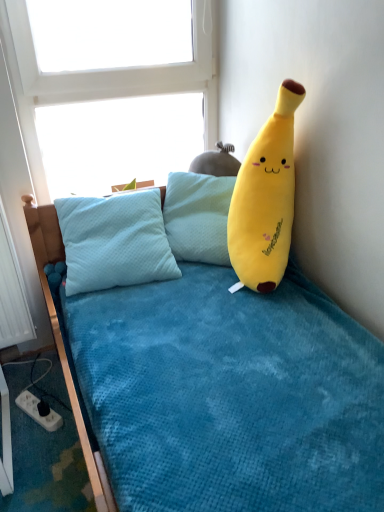
I want to click on soft yellow plush banana at upper right, so click(265, 199).

What do you see at coordinates (265, 199) in the screenshot? The image size is (384, 512). I see `soft yellow plush banana at upper right` at bounding box center [265, 199].

This screenshot has width=384, height=512. I want to click on transparent glass window at upper center, so click(x=105, y=79).

Does point (56, 417) come behind point (233, 219)?

That is True.

In the scene shown: Considering the sizes of objects white plastic power outlet at lower left and soft yellow plush banana at upper right in the image provided, who is taller, white plastic power outlet at lower left or soft yellow plush banana at upper right?

Standing taller between the two is soft yellow plush banana at upper right.

From a real-world perspective, which is physically above, white plastic power outlet at lower left or soft yellow plush banana at upper right?

soft yellow plush banana at upper right, from a real-world perspective.

From the image's perspective, is white plastic power outlet at lower left located above or below soft yellow plush banana at upper right?

white plastic power outlet at lower left is below soft yellow plush banana at upper right.

Where is `toy lying in front of the white plastic power outlet at lower left`? The width and height of the screenshot is (384, 512). toy lying in front of the white plastic power outlet at lower left is located at coordinates (265, 199).

Are soft yellow plush banana at upper right and white plastic power outlet at lower left making contact?

No, soft yellow plush banana at upper right is not touching white plastic power outlet at lower left.

Could you tell me if soft yellow plush banana at upper right is turned towards white plastic power outlet at lower left?

No, soft yellow plush banana at upper right is not facing towards white plastic power outlet at lower left.

Who is taller, soft yellow plush banana at upper right or white plastic power outlet at lower left?

soft yellow plush banana at upper right.

What are the coordinates of `toy lying on the right of transparent glass window at upper center` in the screenshot? It's located at (265, 199).

Is point (1, 28) closer or farther from the camera than point (282, 93)?

Point (1, 28) is farther from the camera than point (282, 93).

Is transparent glass window at upper center not within soft yellow plush banana at upper right?

transparent glass window at upper center is positioned outside soft yellow plush banana at upper right.

From a real-world perspective, is white plastic power outlet at lower left on top of transparent glass window at upper center?

Actually, white plastic power outlet at lower left is physically below transparent glass window at upper center in the real world.

From the image's perspective, is white plastic power outlet at lower left on top of transparent glass window at upper center?

Incorrect, from the image's perspective, white plastic power outlet at lower left is lower than transparent glass window at upper center.

From their relative heights in the image, would you say white plastic power outlet at lower left is taller or shorter than transparent glass window at upper center?

white plastic power outlet at lower left is shorter than transparent glass window at upper center.

Considering the sizes of objects white plastic power outlet at lower left and transparent glass window at upper center in the image provided, who is bigger, white plastic power outlet at lower left or transparent glass window at upper center?

With larger size is transparent glass window at upper center.

Is soft yellow plush banana at upper right next to transparent glass window at upper center and touching it?

soft yellow plush banana at upper right and transparent glass window at upper center are not in contact.

Which of these two, soft yellow plush banana at upper right or transparent glass window at upper center, is bigger?

soft yellow plush banana at upper right.

From a real-world perspective, is soft yellow plush banana at upper right over transparent glass window at upper center?

No, from a real-world perspective, soft yellow plush banana at upper right is not over transparent glass window at upper center

Between soft yellow plush banana at upper right and transparent glass window at upper center, which one appears on the left side from the viewer's perspective?

transparent glass window at upper center.

Which object is closer to the camera taking this photo, transparent glass window at upper center or white plastic power outlet at lower left?

transparent glass window at upper center is closer to the camera.

Is transparent glass window at upper center not within white plastic power outlet at lower left?

That's correct, transparent glass window at upper center is outside of white plastic power outlet at lower left.

Which is farther, (10, 29) or (20, 404)?

Positioned behind is point (20, 404).

Is transparent glass window at upper center next to white plastic power outlet at lower left?

No.

In the image, there is a soft yellow plush banana at upper right. Where is `power outlet below it (from the image's perspective)`? This screenshot has height=512, width=384. power outlet below it (from the image's perspective) is located at coordinates (38, 412).

There is a white plastic power outlet at lower left. Where is `toy above it (from a real-world perspective)`? toy above it (from a real-world perspective) is located at coordinates (265, 199).

Based on their spatial positions, is soft yellow plush banana at upper right or transparent glass window at upper center further from white plastic power outlet at lower left?

transparent glass window at upper center.

Estimate the real-world distances between objects in this image. Which object is closer to white plastic power outlet at lower left, transparent glass window at upper center or soft yellow plush banana at upper right?

soft yellow plush banana at upper right is closer to white plastic power outlet at lower left.

When comparing their distances from transparent glass window at upper center, does white plastic power outlet at lower left or soft yellow plush banana at upper right seem closer?

The object closer to transparent glass window at upper center is soft yellow plush banana at upper right.

When comparing their distances from transparent glass window at upper center, does soft yellow plush banana at upper right or white plastic power outlet at lower left seem further?

white plastic power outlet at lower left lies further to transparent glass window at upper center than the other object.

Looking at the image, which one is located further to soft yellow plush banana at upper right, transparent glass window at upper center or white plastic power outlet at lower left?

Based on the image, white plastic power outlet at lower left appears to be further to soft yellow plush banana at upper right.

Based on their spatial positions, is white plastic power outlet at lower left or transparent glass window at upper center further from soft yellow plush banana at upper right?

white plastic power outlet at lower left.

Locate an element on the screen. The height and width of the screenshot is (512, 384). toy between transparent glass window at upper center and white plastic power outlet at lower left from top to bottom is located at coordinates (265, 199).